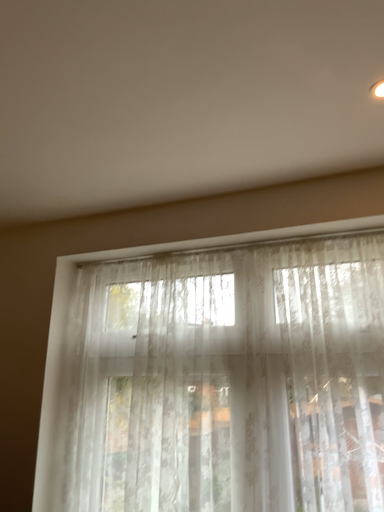
Locate an element on the screen. This screenshot has height=512, width=384. white sheer curtains at lower center is located at coordinates (181, 99).

What do you see at coordinates (181, 99) in the screenshot?
I see `white sheer curtains at lower center` at bounding box center [181, 99].

You are a GUI agent. You are given a task and a screenshot of the screen. Output one action in this format:
    pyautogui.click(x=<x>, y=<y>)
    Task: Click on the translucent lace curtain at center
    This screenshot has height=512, width=384.
    Given the screenshot: What is the action you would take?
    pyautogui.click(x=225, y=382)

The height and width of the screenshot is (512, 384). Describe the element at coordinates (225, 382) in the screenshot. I see `translucent lace curtain at center` at that location.

Image resolution: width=384 pixels, height=512 pixels. I want to click on white sheer curtains at lower center, so click(x=181, y=99).

Does translucent lace curtain at center appear on the left side of white sheer curtains at lower center?

No.

Considering the relative positions of translucent lace curtain at center and white sheer curtains at lower center in the image provided, is translucent lace curtain at center behind white sheer curtains at lower center?

Yes, it is behind white sheer curtains at lower center.

Which is less distant, (x=382, y=275) or (x=74, y=106)?

Point (x=382, y=275) is farther from the camera than point (x=74, y=106).

From the image's perspective, is translucent lace curtain at center located beneath white sheer curtains at lower center?

Yes.

From a real-world perspective, relative to white sheer curtains at lower center, is translucent lace curtain at center vertically above or below?

translucent lace curtain at center is below white sheer curtains at lower center.

Which of these two, translucent lace curtain at center or white sheer curtains at lower center, is thinner?

translucent lace curtain at center.

Is translucent lace curtain at center taller than white sheer curtains at lower center?

Correct, translucent lace curtain at center is much taller as white sheer curtains at lower center.

Based on their sizes in the image, would you say translucent lace curtain at center is bigger or smaller than white sheer curtains at lower center?

In the image, translucent lace curtain at center appears to be smaller than white sheer curtains at lower center.

Do you think translucent lace curtain at center is within white sheer curtains at lower center, or outside of it?

translucent lace curtain at center is not inside white sheer curtains at lower center, it's outside.

Is translucent lace curtain at center not near white sheer curtains at lower center?

Actually, translucent lace curtain at center and white sheer curtains at lower center are a little close together.

Is translucent lace curtain at center oriented towards white sheer curtains at lower center?

Yes, translucent lace curtain at center is oriented towards white sheer curtains at lower center.

What's the angular difference between translucent lace curtain at center and white sheer curtains at lower center's facing directions?

translucent lace curtain at center and white sheer curtains at lower center are facing 90.2 degrees away from each other.

How distant is translucent lace curtain at center from white sheer curtains at lower center?

They are 29.11 inches apart.

At what (x,y) coordinates should I click in order to perform the action: click on backdrop that is above the translucent lace curtain at center (from a real-world perspective). Please return your answer as a coordinate pair (x, y). Looking at the image, I should click on (181, 99).

Is white sheer curtains at lower center at the right side of translucent lace curtain at center?

No, white sheer curtains at lower center is not to the right of translucent lace curtain at center.

Between white sheer curtains at lower center and translucent lace curtain at center, which one is positioned in front?

white sheer curtains at lower center is more forward.

Which is nearer, (x=299, y=93) or (x=274, y=436)?

The point (x=299, y=93) is in front.

From the image's perspective, is white sheer curtains at lower center under translucent lace curtain at center?

Actually, white sheer curtains at lower center appears above translucent lace curtain at center in the image.

From a real-world perspective, which object stands above the other?

From a 3D spatial view, white sheer curtains at lower center is above.

Which object is thinner, white sheer curtains at lower center or translucent lace curtain at center?

Thinner between the two is translucent lace curtain at center.

Looking at this image, considering the relative sizes of white sheer curtains at lower center and translucent lace curtain at center in the image provided, is white sheer curtains at lower center shorter than translucent lace curtain at center?

Yes.

In the scene shown: Considering the sizes of white sheer curtains at lower center and translucent lace curtain at center in the image, is white sheer curtains at lower center bigger or smaller than translucent lace curtain at center?

white sheer curtains at lower center is bigger than translucent lace curtain at center.

In the scene shown: Choose the correct answer: Is white sheer curtains at lower center inside translucent lace curtain at center or outside it?

white sheer curtains at lower center is not enclosed by translucent lace curtain at center.

Would you consider white sheer curtains at lower center to be distant from translucent lace curtain at center?

They are positioned close to each other.

Is translucent lace curtain at center at the back of white sheer curtains at lower center?

No, white sheer curtains at lower center's orientation is not away from translucent lace curtain at center.

In the scene shown: How many degrees apart are the facing directions of white sheer curtains at lower center and translucent lace curtain at center?

90.2 degrees.

I want to click on curtain located underneath the white sheer curtains at lower center (from a real-world perspective), so click(225, 382).

I want to click on backdrop in front of the translucent lace curtain at center, so click(181, 99).

What are the coordinates of `curtain below the white sheer curtains at lower center (from the image's perspective)` in the screenshot? It's located at (225, 382).